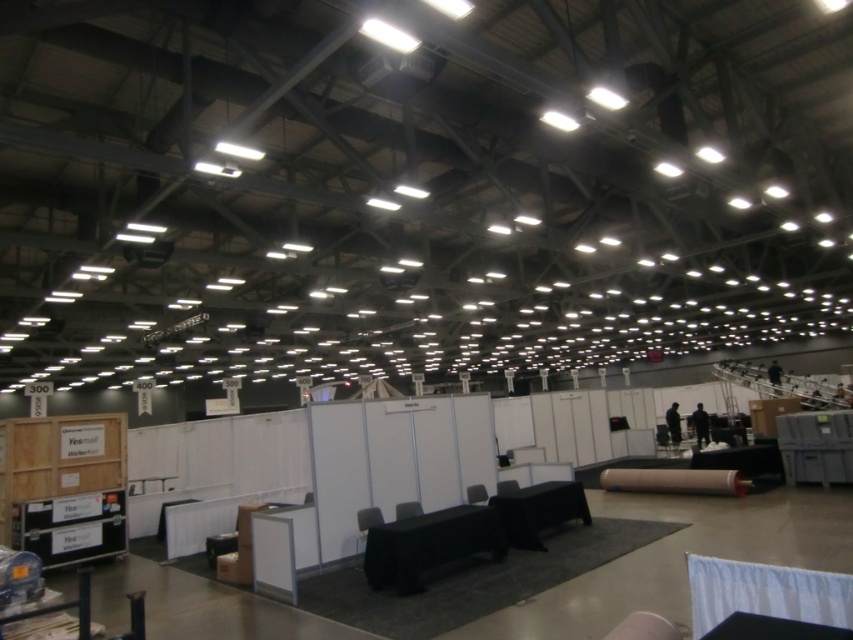
Question: Where is matte cardboard roll at center located in relation to matte black chair at center in the image?

Choices:
 (A) below
 (B) above

Answer: (A)

Question: Which point appears farthest from the camera in this image?

Choices:
 (A) (631, 476)
 (B) (503, 484)
 (C) (397, 515)
 (D) (482, 484)

Answer: (A)

Question: Is matte gray chair at center bigger than black fabric chair at center?

Choices:
 (A) no
 (B) yes

Answer: (A)

Question: From the image, what is the correct spatial relationship of matte black chair at center in relation to matte gray chair at center?

Choices:
 (A) right
 (B) left

Answer: (B)

Question: Based on their relative distances, which object is farther from the matte cardboard roll at center?

Choices:
 (A) black fabric chair at center
 (B) matte black chair at center

Answer: (B)

Question: Which point is farther to the camera?

Choices:
 (A) (486, 502)
 (B) (500, 481)
 (C) (744, 477)
 (D) (403, 509)

Answer: (C)